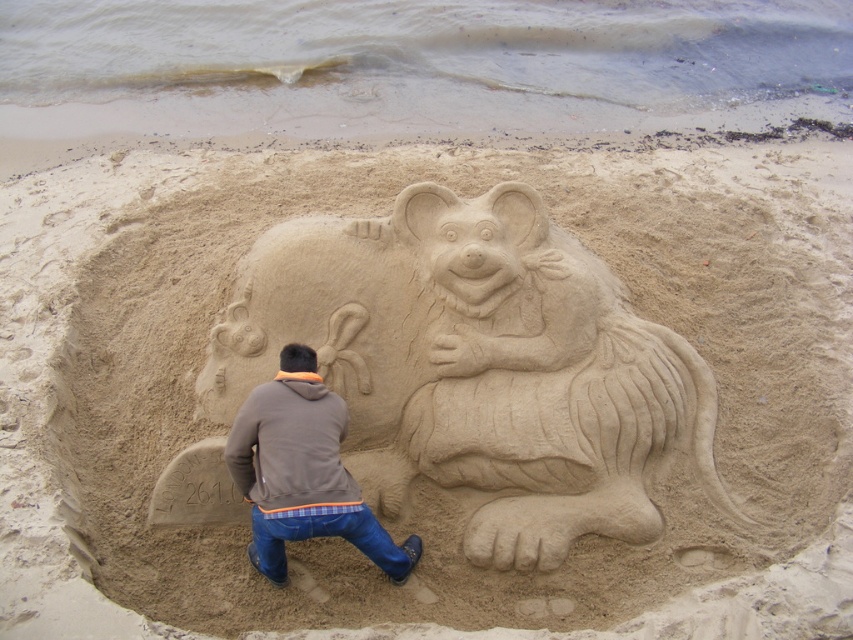
Is smooth sand bear at center further to the viewer compared to brown fleece jacket at lower center?

That is True.

Who is higher up, smooth sand bear at center or brown fleece jacket at lower center?

Positioned higher is smooth sand bear at center.

Is point (548, 275) in front of point (276, 440)?

That is False.

In order to click on smooth sand bear at center in this screenshot , I will do `click(477, 365)`.

Is smooth sand bear at center wider than brown cotton hoodie at center?

Correct, the width of smooth sand bear at center exceeds that of brown cotton hoodie at center.

Which of these two, smooth sand bear at center or brown cotton hoodie at center, stands shorter?

brown cotton hoodie at center is shorter.

What do you see at coordinates (477, 365) in the screenshot? I see `smooth sand bear at center` at bounding box center [477, 365].

Image resolution: width=853 pixels, height=640 pixels. In order to click on smooth sand bear at center in this screenshot , I will do `click(477, 365)`.

Does point (289, 371) come behind point (271, 508)?

Yes, point (289, 371) is farther from viewer.

Between brown cotton hoodie at center and brown fleece jacket at lower center, which one is positioned lower?

Positioned lower is brown cotton hoodie at center.

Find the location of a particular element. This screenshot has height=640, width=853. brown cotton hoodie at center is located at coordinates (303, 472).